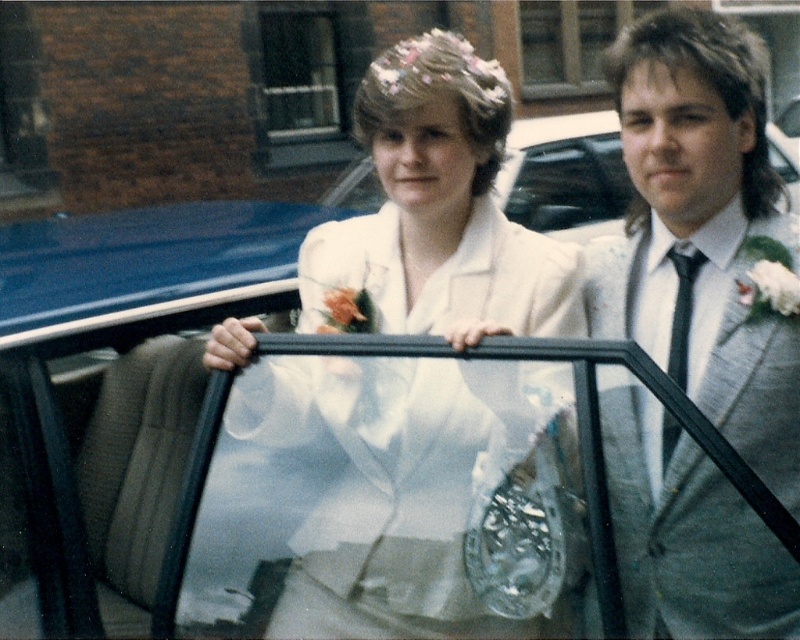
In the scene shown: Does white satin dress at center appear over gray suit at right?

Indeed, white satin dress at center is positioned over gray suit at right.

From the picture: Who is more distant from viewer, (436, 424) or (762, 627)?

The point (436, 424) is more distant.

Identify the location of white satin dress at center. Image resolution: width=800 pixels, height=640 pixels. (392, 486).